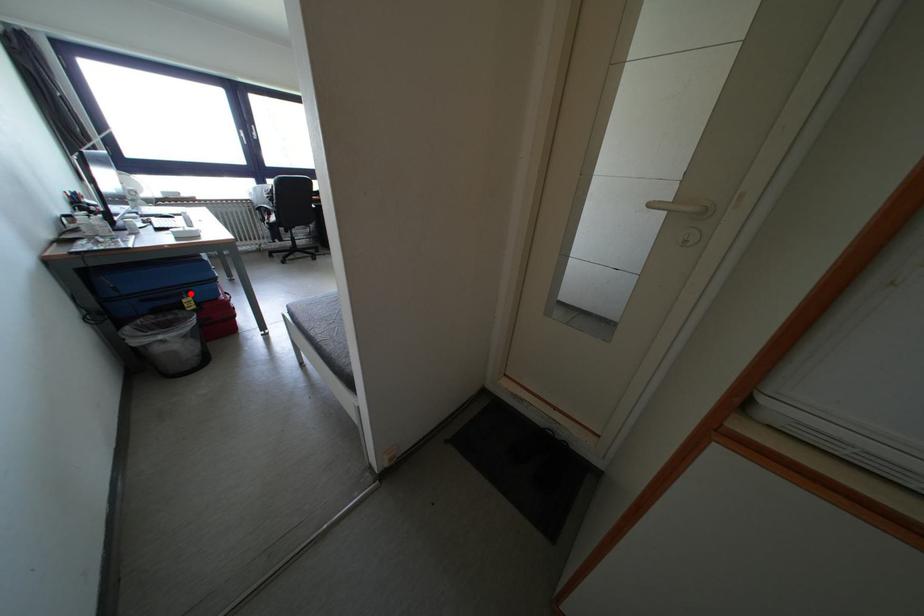
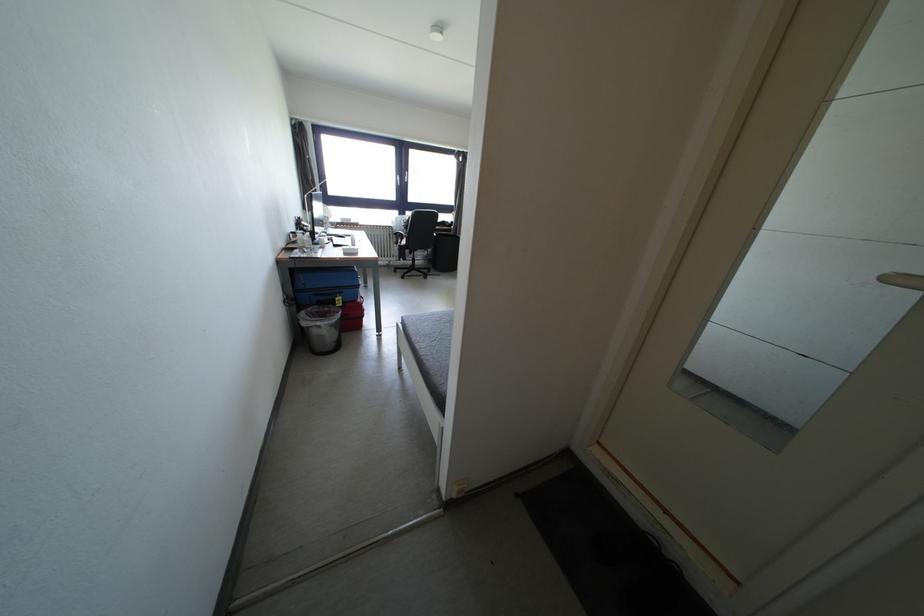
Question: I am providing you with two images of the same scene from different viewpoints. In image1, a red point is highlighted. Considering the same 3D point in image2, which of the following is correct?

Choices:
 (A) It is closer
 (B) It is farther

Answer: (A)